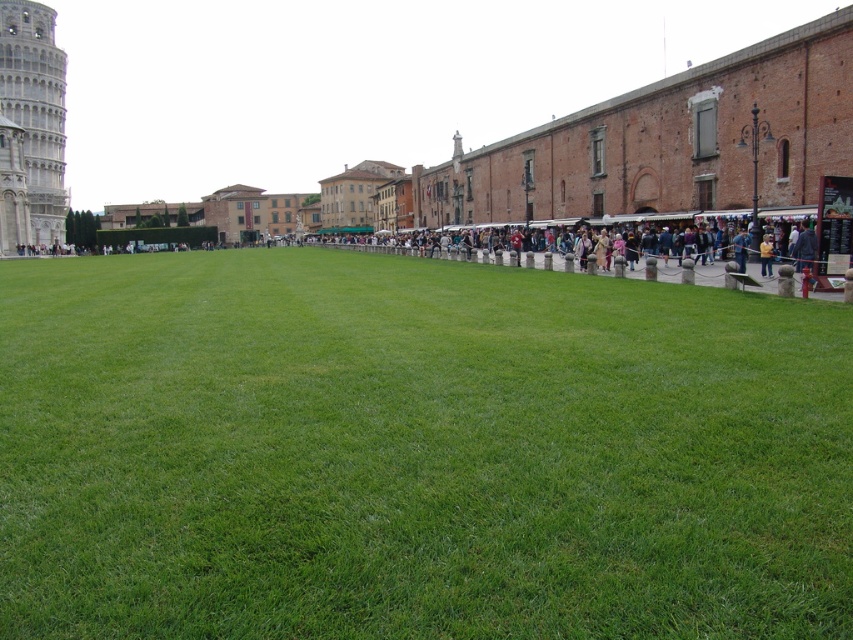
You are standing in the park and see the green grass at center and the white stone tower at left. Which object is closer to the horizon?

The white stone tower at left is closer to the horizon than the green grass at center because the green grass at center is positioned under it.

You are a photographer planning to capture the white stone tower at left in the background while including the green grass at center in the foreground. Based on their heights, which object will appear larger in the photo?

The white stone tower at left will appear larger in the photo because it is taller than the green grass at center.

You are standing at the origin point of the coordinate system in the image. You want to walk to the green grass at center. What direction should you move in to reach it?

The green grass at center is located at coordinate point (415, 451). Since you are at the origin, you should move in the positive x and positive y direction to reach it.